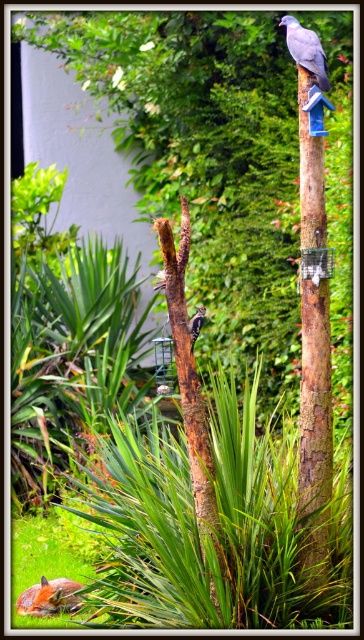
Which of these two, brown rough wood pole at upper right or gray matte bird at upper right, stands taller?

brown rough wood pole at upper right is taller.

Between brown rough wood pole at upper right and gray matte bird at upper right, which one has less height?

With less height is gray matte bird at upper right.

Find the location of `brown rough wood pole at upper right`. brown rough wood pole at upper right is located at coordinates (314, 355).

Find the location of a particular element. brown rough wood pole at upper right is located at coordinates (314, 355).

Who is higher up, matte gray pigeon at upper center or gray matte bird at upper right?

gray matte bird at upper right is above.

Where is `matte gray pigeon at upper center`? The width and height of the screenshot is (364, 640). matte gray pigeon at upper center is located at coordinates (49, 596).

Find the location of a particular element. The height and width of the screenshot is (640, 364). matte gray pigeon at upper center is located at coordinates (49, 596).

Who is taller, matte gray pigeon at upper center or brown speckled woodpecker at center?

matte gray pigeon at upper center

Does matte gray pigeon at upper center have a lesser width compared to brown speckled woodpecker at center?

No.

This screenshot has height=640, width=364. I want to click on matte gray pigeon at upper center, so click(49, 596).